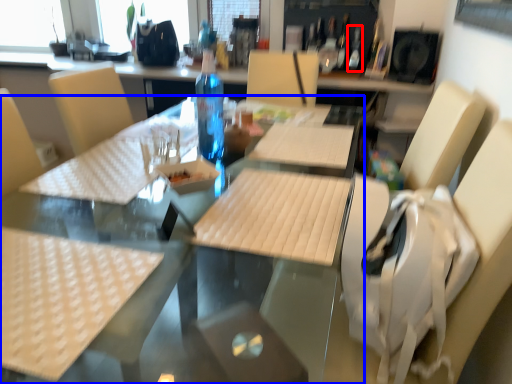
Question: Which object appears closest to the camera in this image, bottle (highlighted by a red box) or table (highlighted by a blue box)?

Choices:
 (A) bottle
 (B) table

Answer: (B)